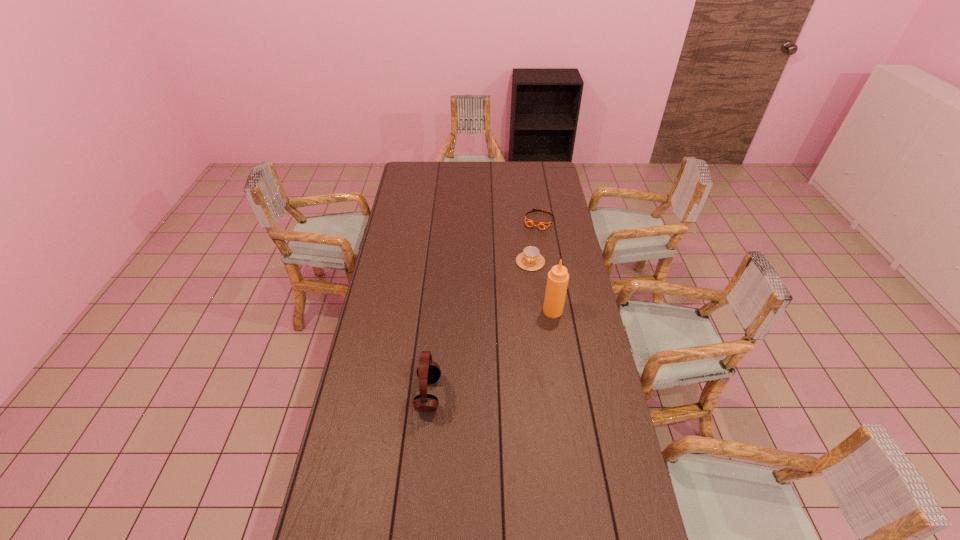
The height and width of the screenshot is (540, 960). I want to click on blank region between the second shortest object and the goggles, so click(x=535, y=241).

This screenshot has width=960, height=540. In order to click on free space that is in between the leftmost object and the third farthest object in this screenshot , I will do `click(491, 353)`.

Identify which object is located as the third nearest to the third tallest object. Please provide its 2D coordinates. Your answer should be formatted as a tuple, i.e. [(x, y)], where the tuple contains the x and y coordinates of a point satisfying the conditions above.

[(428, 372)]

Select which object appears as the second closest to the condiment. Please provide its 2D coordinates. Your answer should be formatted as a tuple, i.e. [(x, y)], where the tuple contains the x and y coordinates of a point satisfying the conditions above.

[(428, 372)]

Find the location of a particular element. This screenshot has width=960, height=540. blank area in the image that satisfies the following two spatial constraints: 1. on the front side of the tallest object; 2. on the right side of the third nearest object is located at coordinates (537, 310).